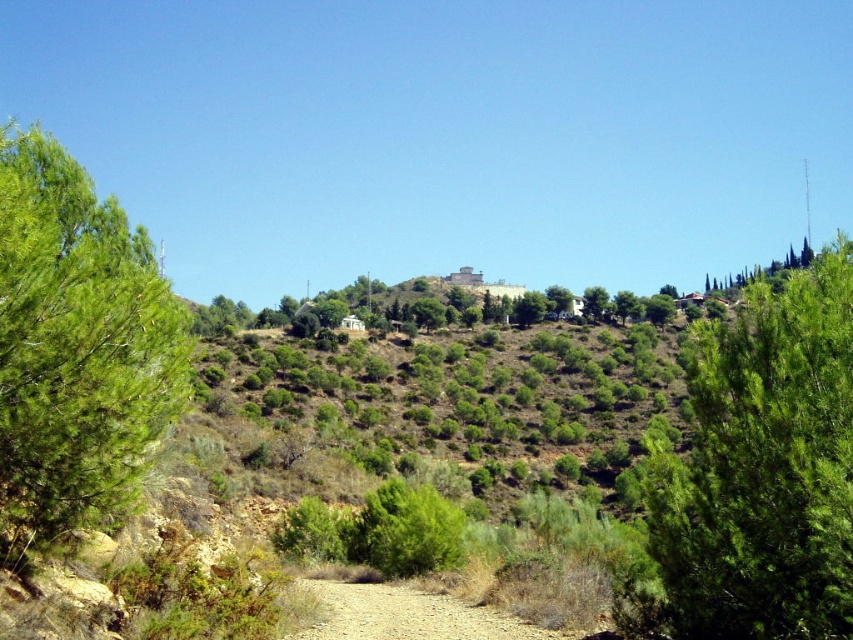
Can you confirm if green leafy bush at upper right is positioned to the left of green leafy tree at upper right?

Yes, green leafy bush at upper right is to the left of green leafy tree at upper right.

Can you confirm if green leafy bush at upper right is bigger than green leafy tree at upper right?

No.

Is point (817, 326) closer to viewer compared to point (602, 321)?

That is True.

Locate an element on the screen. This screenshot has width=853, height=640. green leafy bush at upper right is located at coordinates click(x=763, y=468).

Is point (67, 438) positioned in front of point (447, 612)?

Yes, point (67, 438) is in front of point (447, 612).

Which is more to the right, green needle-like at left or brown gravel path at center?

brown gravel path at center

Image resolution: width=853 pixels, height=640 pixels. Describe the element at coordinates (76, 348) in the screenshot. I see `green needle-like at left` at that location.

I want to click on green needle-like at left, so click(76, 348).

The image size is (853, 640). In order to click on green leafy bush at upper right in this screenshot , I will do `click(763, 468)`.

Who is more forward, (793, 289) or (62, 202)?

Positioned in front is point (793, 289).

At what (x,y) coordinates should I click in order to perform the action: click on green leafy bush at upper right. Please return your answer as a coordinate pair (x, y). Image resolution: width=853 pixels, height=640 pixels. Looking at the image, I should click on (763, 468).